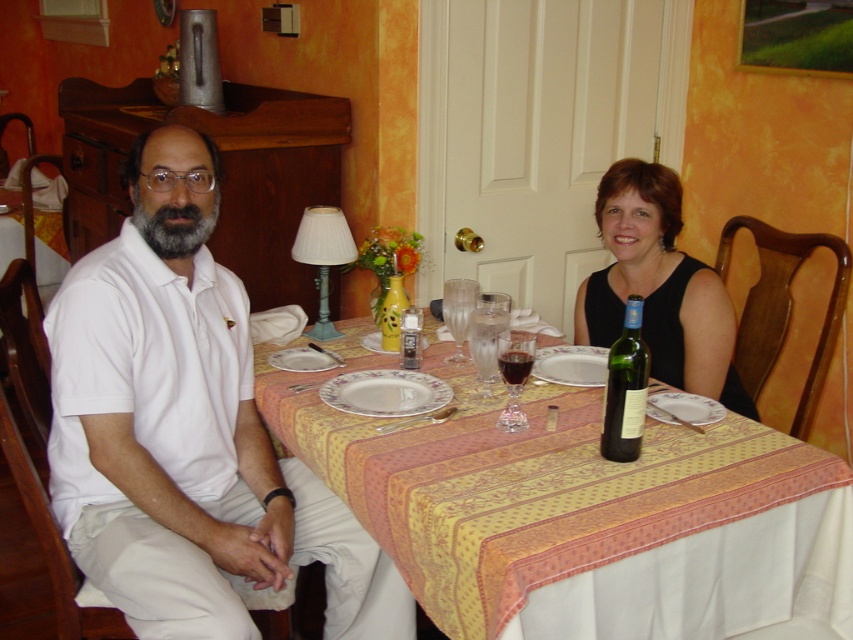
Question: Which object appears farthest from the camera in this image?

Choices:
 (A) transparent glass wine glass at center
 (B) translucent glass vase at table center
 (C) yellow fabric tablecloth at center

Answer: (B)

Question: Is transparent glass wine glass at center to the left of translucent glass vase at table center from the viewer's perspective?

Choices:
 (A) yes
 (B) no

Answer: (B)

Question: Where is black fabric dress at upper right located in relation to transparent glass at table center in the image?

Choices:
 (A) below
 (B) above

Answer: (B)

Question: Is green glass bottle at table center positioned behind transparent glass wine glass at table center?

Choices:
 (A) no
 (B) yes

Answer: (A)

Question: Estimate the real-world distances between objects in this image. Which object is closer to the matte yellow glass bottle at center?

Choices:
 (A) translucent glass vase at table center
 (B) black fabric dress at upper right

Answer: (A)

Question: Estimate the real-world distances between objects in this image. Which object is farther from the transparent glass wine glass at center?

Choices:
 (A) green glass bottle at table center
 (B) matte yellow glass bottle at center
 (C) black fabric dress at upper right
 (D) transparent glass wine glass at table center

Answer: (C)